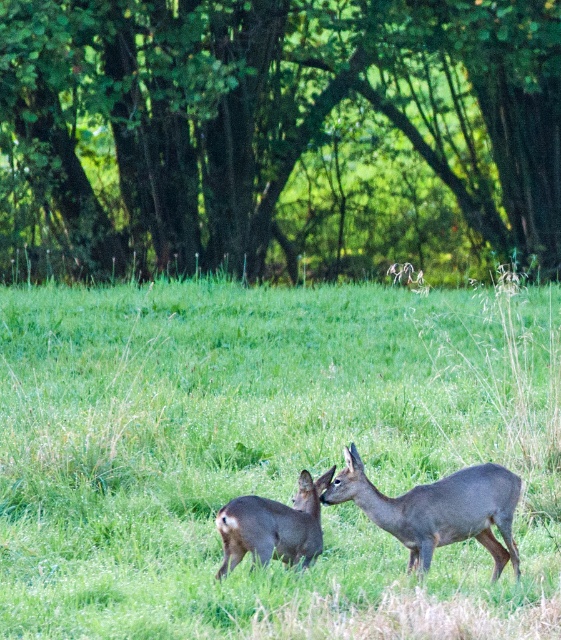
Question: Which is farther from the gray fur deer at center?

Choices:
 (A) gray matte/deer at center
 (B) gray matte deer at lower center

Answer: (A)

Question: Which point is closer to the camera?

Choices:
 (A) gray matte deer at lower center
 (B) gray matte/deer at center

Answer: (A)

Question: Is gray fur deer at center wider than gray matte deer at lower center?

Choices:
 (A) no
 (B) yes

Answer: (B)

Question: Does gray fur deer at center have a lesser width compared to gray matte/deer at center?

Choices:
 (A) no
 (B) yes

Answer: (A)

Question: Does gray fur deer at center have a greater width compared to gray matte deer at lower center?

Choices:
 (A) no
 (B) yes

Answer: (B)

Question: Estimate the real-world distances between objects in this image. Which object is farther from the gray matte deer at lower center?

Choices:
 (A) gray fur deer at center
 (B) gray matte/deer at center

Answer: (A)